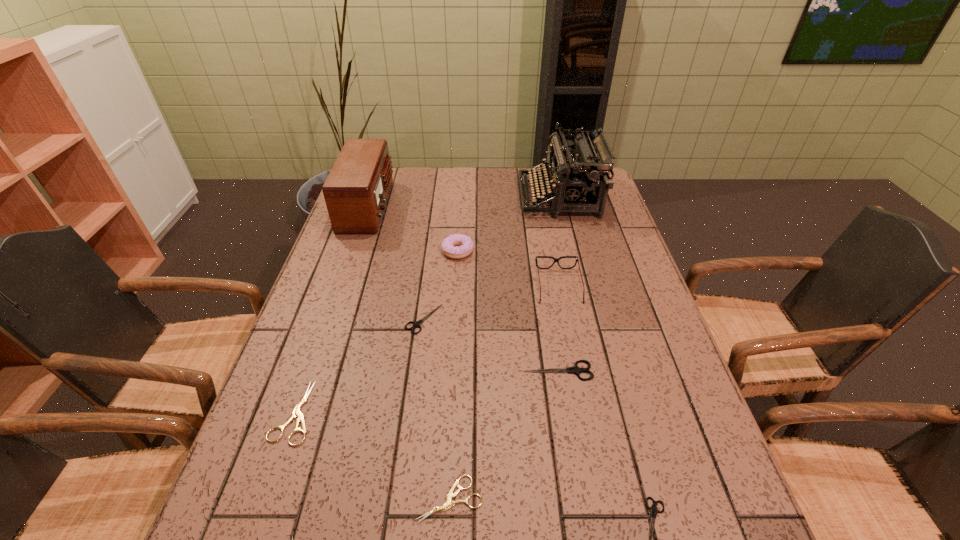
Select which object appears as the ninth closest to the farthest shears. Please provide its 2D coordinates. Your answer should be formatted as a tuple, i.e. [(x, y)], where the tuple contains the x and y coordinates of a point satisfying the conditions above.

[(653, 509)]

Identify which shears is the fifth closest to the tallest object. Please provide its 2D coordinates. Your answer should be formatted as a tuple, i.e. [(x, y)], where the tuple contains the x and y coordinates of a point satisfying the conditions above.

[(653, 509)]

Where is `shears that is the fourth closest to the radio receiver`? This screenshot has height=540, width=960. shears that is the fourth closest to the radio receiver is located at coordinates (449, 504).

Identify the location of the closest black shears to the third farthest object. (417, 324).

Choose which black shears is the second nearest neighbor to the leftmost beige shears. Please provide its 2D coordinates. Your answer should be formatted as a tuple, i.e. [(x, y)], where the tuple contains the x and y coordinates of a point satisfying the conditions above.

[(575, 369)]

Find the location of a particular element. Image resolution: width=960 pixels, height=540 pixels. beige shears that is the third closest one to the tallest object is located at coordinates click(x=292, y=537).

Identify which beige shears is located as the second nearest to the farthest beige shears. Please provide its 2D coordinates. Your answer should be formatted as a tuple, i.e. [(x, y)], where the tuple contains the x and y coordinates of a point satisfying the conditions above.

[(449, 504)]

What are the coordinates of `vacant region that satisfies the following two spatial constraints: 1. on the front side of the leftmost black shears; 2. on the right side of the second biggest beige shears` in the screenshot? It's located at (400, 499).

At what (x,y) coordinates should I click in order to perform the action: click on vacant space that satisfies the following two spatial constraints: 1. on the front side of the fourth tallest object; 2. on the left side of the rightmost beige shears. Please return your answer as a coordinate pair (x, y). Looking at the image, I should click on (443, 499).

You are a GUI agent. You are given a task and a screenshot of the screen. Output one action in this format:
    pyautogui.click(x=<x>, y=<y>)
    Task: Click on the free spot that satisfies the following two spatial constraints: 1. on the front-facing side of the radio receiver; 2. on the back side of the second biggest beige shears
    
    Given the screenshot: What is the action you would take?
    pyautogui.click(x=269, y=499)